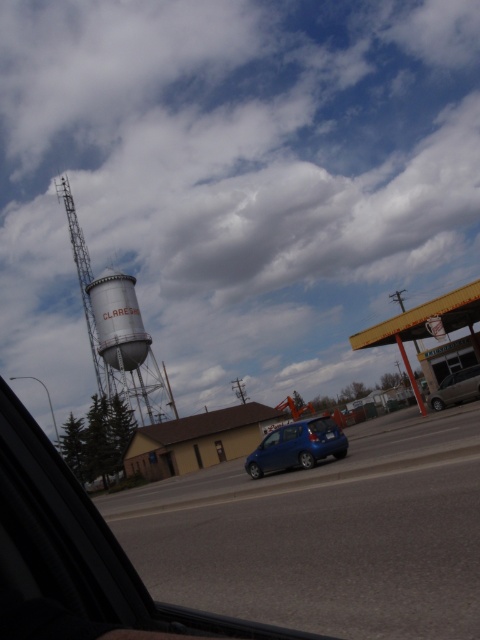
You are a photographer trying to capture a wide shot of the gray concrete water tower at center and the satin blue hatchback at center from the road. Based on their sizes, which object will appear bigger in your photo?

The gray concrete water tower at center will appear bigger in the photo because its width is larger than that of the satin blue hatchback at center.

You are a photographer trying to capture the entire gray concrete water tower at center and metallic silver car at lower right in a single photo. Given that your camera can only focus on objects within a 100m height range, will you be able to do so?

The gray concrete water tower at center is much taller than the metallic silver car at lower right. Since the camera can focus on objects within a 100m height range, and the height difference between them is within this range, you can capture both in a single photo.